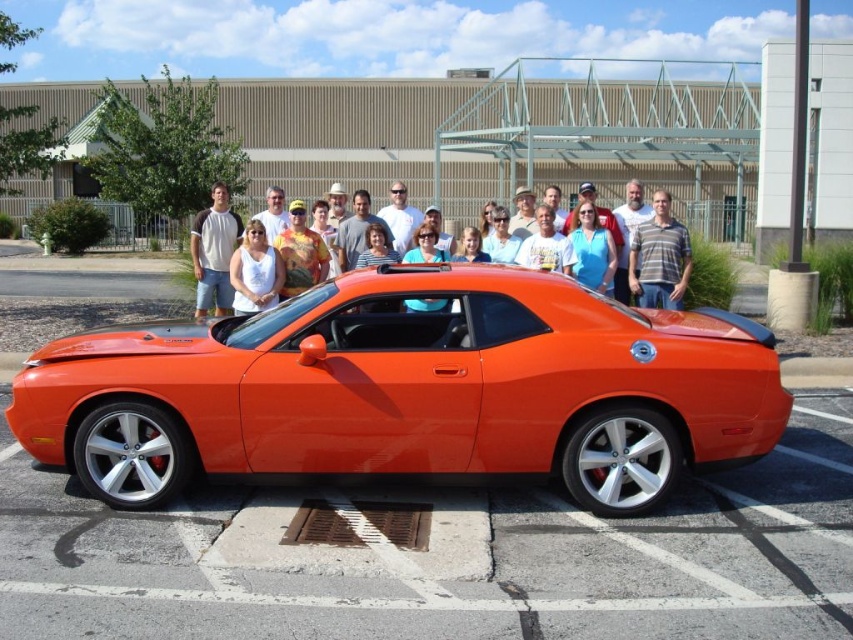
Question: Estimate the real-world distances between objects in this image. Which object is closer to the striped cotton shirt at center?

Choices:
 (A) glossy orange sports car at center
 (B) matte orange car at center

Answer: (A)

Question: Which object appears closest to the camera in this image?

Choices:
 (A) white matte tank top at center
 (B) striped cotton shirt at center

Answer: (A)

Question: Is striped cotton shirt at center to the left of white matte tank top at center from the viewer's perspective?

Choices:
 (A) yes
 (B) no

Answer: (B)

Question: Which of the following is the closest to the observer?

Choices:
 (A) glossy orange sports car at center
 (B) matte orange car at center
 (C) matte white t-shirt at center

Answer: (A)

Question: Does glossy orange sports car at center appear over striped cotton shirt at center?

Choices:
 (A) no
 (B) yes

Answer: (A)

Question: Is striped cotton shirt at center smaller than white matte tank top at center?

Choices:
 (A) no
 (B) yes

Answer: (B)